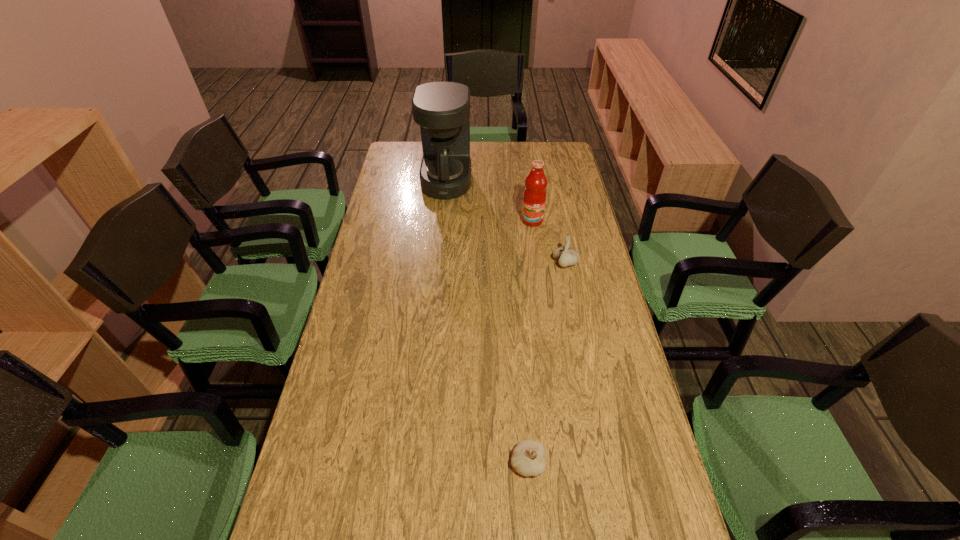
At what (x,y) coordinates should I click in order to perform the action: click on free space that satisfies the following two spatial constraints: 1. on the front label of the fruit juice; 2. on the right side of the rightmost object. Please return your answer as a coordinate pair (x, y). The image size is (960, 540). Looking at the image, I should click on (538, 263).

The height and width of the screenshot is (540, 960). What are the coordinates of `vacant area that satisfies the following two spatial constraints: 1. on the button side of the taller garlic; 2. on the right side of the tallest object` in the screenshot? It's located at (439, 263).

In order to click on free region that satisfies the following two spatial constraints: 1. on the button side of the tallest object; 2. on the left side of the taller garlic in this screenshot , I will do `click(439, 263)`.